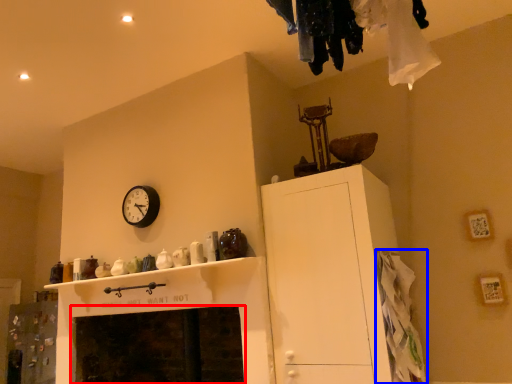
Question: Which point is further to the camera, fireplace (highlighted by a red box) or clothing (highlighted by a blue box)?

Choices:
 (A) fireplace
 (B) clothing

Answer: (A)